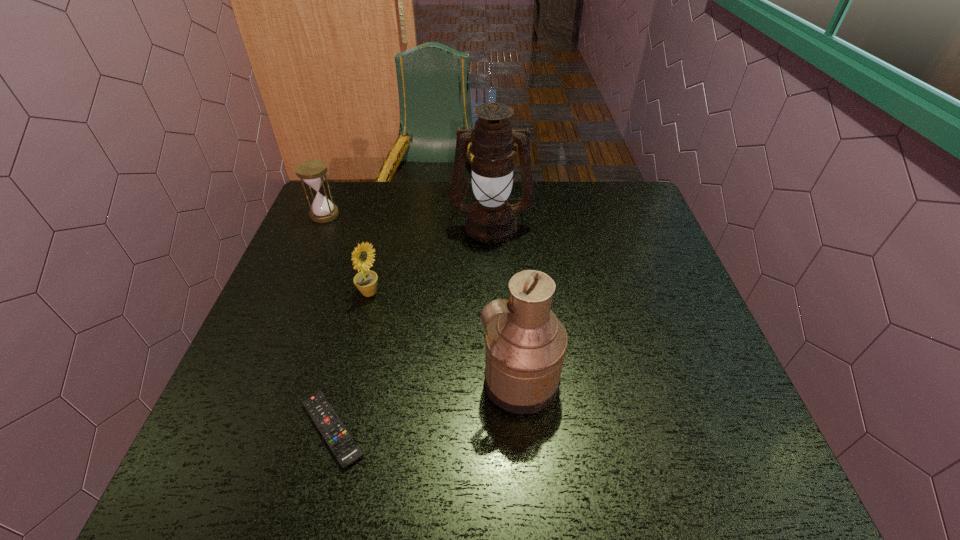
Find the location of a particular element. oil lamp is located at coordinates (491, 219).

Where is `the fourth shortest object`? the fourth shortest object is located at coordinates (526, 343).

Locate an element on the screen. The height and width of the screenshot is (540, 960). hourglass is located at coordinates (312, 172).

At what (x,y) coordinates should I click in order to perform the action: click on sunflower. Please return your answer as a coordinate pair (x, y). Image resolution: width=960 pixels, height=540 pixels. Looking at the image, I should click on (366, 281).

The height and width of the screenshot is (540, 960). Find the location of `remote control`. remote control is located at coordinates (345, 449).

Where is `free location located 0.310m on the front of the oil lamp`? This screenshot has height=540, width=960. free location located 0.310m on the front of the oil lamp is located at coordinates (494, 329).

The height and width of the screenshot is (540, 960). Find the location of `vacant space located on the right of the fourth shortest object`. vacant space located on the right of the fourth shortest object is located at coordinates (692, 381).

The height and width of the screenshot is (540, 960). What are the coordinates of `vacant space positioned on the right of the leftmost object` in the screenshot? It's located at (457, 214).

At what (x,y) coordinates should I click in order to perform the action: click on blank space located 0.290m on the face of the sunflower. Please return your answer as a coordinate pair (x, y). Looking at the image, I should click on (497, 293).

Locate an element on the screen. free space located 0.070m on the back of the remote control is located at coordinates (348, 364).